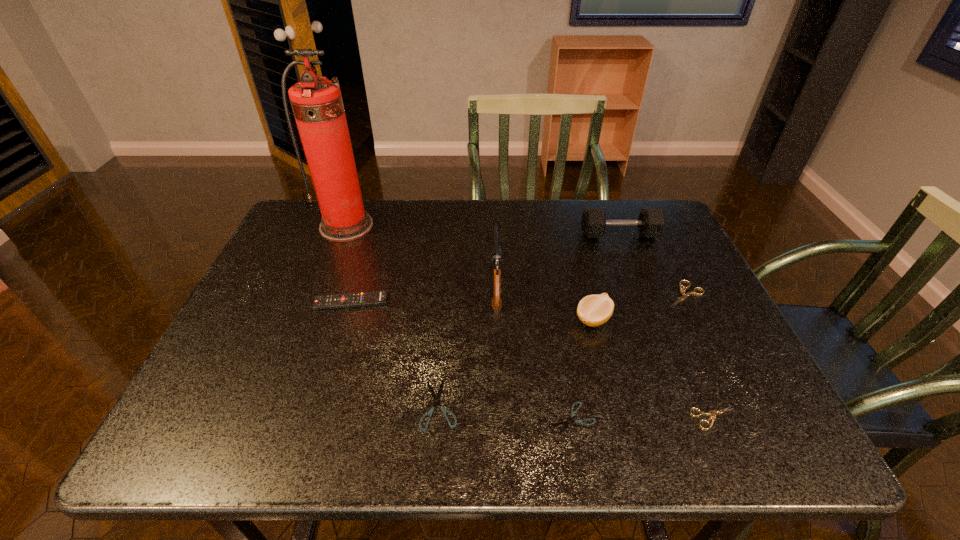
Where is `vacant area between the nearer beige shears and the fifth object from left to right`? vacant area between the nearer beige shears and the fifth object from left to right is located at coordinates (643, 418).

Identify the location of empty space that is in between the gun and the sixth shortest object. (544, 301).

Locate an element on the screen. free point between the smaller black shears and the smaller beige shears is located at coordinates 643,418.

Find the location of a particular element. The height and width of the screenshot is (540, 960). free space that is in between the dumbbell and the farthest shears is located at coordinates (652, 265).

The height and width of the screenshot is (540, 960). Find the location of `vacant area between the fire extinguisher and the leftmost shears`. vacant area between the fire extinguisher and the leftmost shears is located at coordinates (393, 315).

This screenshot has width=960, height=540. What are the coordinates of `unoccupied position between the shortest object and the fourth object from left to right` in the screenshot? It's located at (534, 351).

The height and width of the screenshot is (540, 960). I want to click on empty location between the leftmost shears and the fifth shortest object, so click(396, 354).

Locate an element on the screen. This screenshot has height=540, width=960. vacant space in between the shortest object and the farthest shears is located at coordinates (629, 356).

Locate an element on the screen. empty space that is in between the bigger beige shears and the lemon is located at coordinates (638, 307).

Identify which object is the sixth nearest to the bigger black shears. Please provide its 2D coordinates. Your answer should be formatted as a tuple, i.e. [(x, y)], where the tuple contains the x and y coordinates of a point satisfying the conditions above.

[(317, 104)]